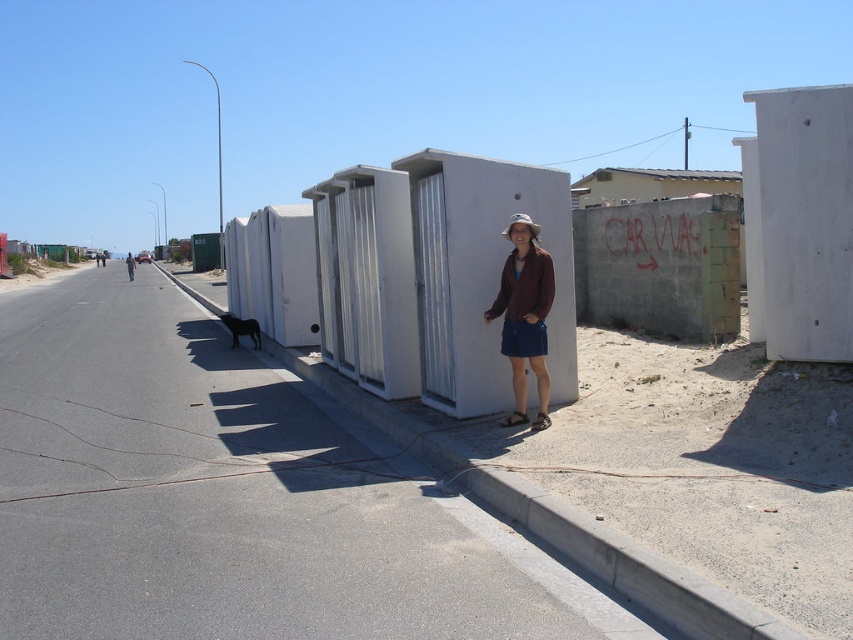
You are a drone operator trying to capture a photo of the metallic corrugated roof at upper center. The drone is currently at point 0.289, 0.763. Is the drone positioned directly above the roof?

Yes, the metallic corrugated roof at upper center is located exactly at point (650, 184), so the drone is positioned directly above it.

You are a painter who needs to decide which surface to paint first. Based on the scene, which object is narrower between the white concrete wall at upper right and the metallic corrugated roof at upper center?

The white concrete wall at upper right is thinner than the metallic corrugated roof at upper center, so it is narrower and should be painted first.

You are a photographer trying to capture the brown leather jacket at center while avoiding the metallic corrugated roof at upper center from appearing in the shot. Can you adjust your position to do so?

The metallic corrugated roof at upper center is above the brown leather jacket at center, so if you lower your camera angle or move closer to the jacket, you can avoid the roof appearing in the shot.